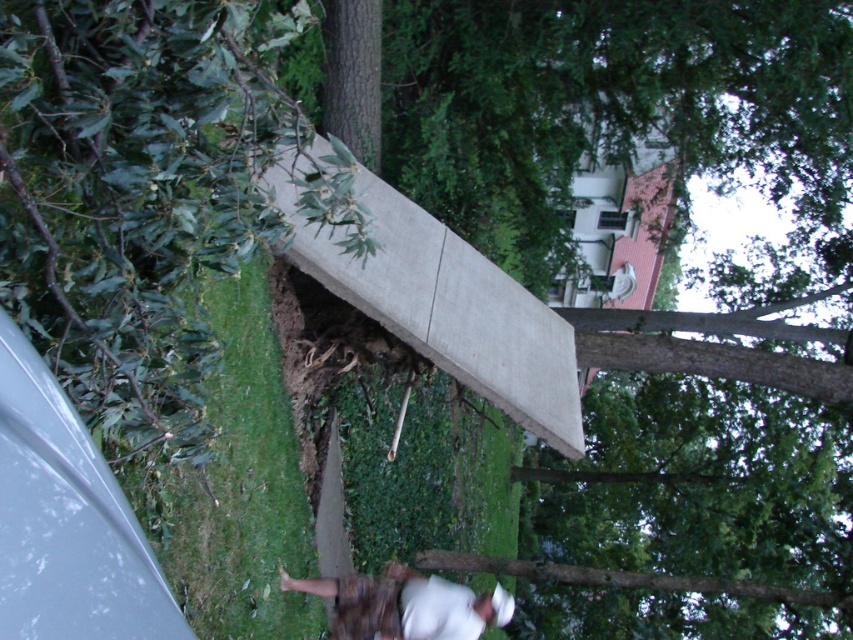
Does green grass at lower left appear on the left side of white matte skateboard at lower center?

Yes, green grass at lower left is to the left of white matte skateboard at lower center.

Can you confirm if green grass at lower left is wider than white matte skateboard at lower center?

No, green grass at lower left is not wider than white matte skateboard at lower center.

Who is more distant from viewer, (256, 353) or (409, 636)?

Point (409, 636)

The height and width of the screenshot is (640, 853). Identify the location of green grass at lower left. [234, 481].